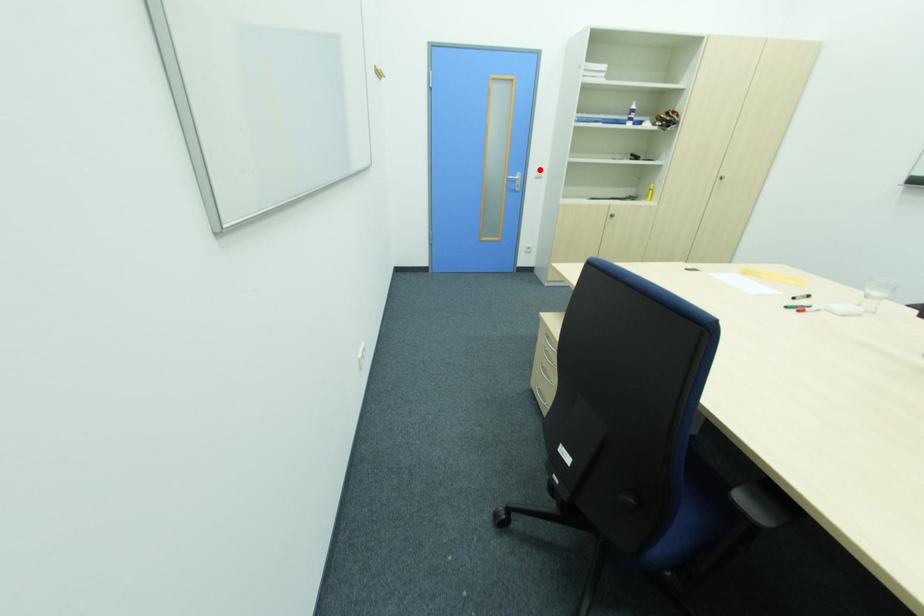
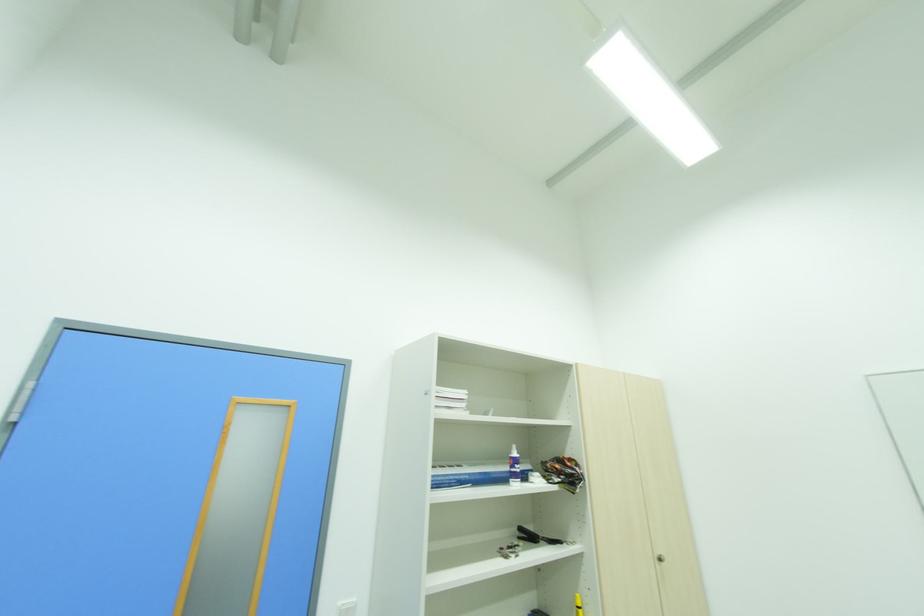
Question: I am providing you with two images of the same scene from different viewpoints. Given a red point in image1, look at the same physical point in image2. Is it:

Choices:
 (A) Closer to the viewpoint
 (B) Farther from the viewpoint

Answer: (B)